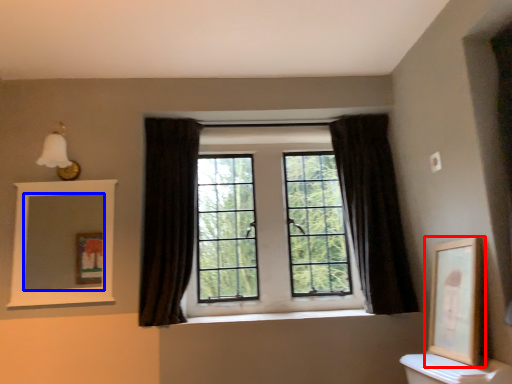
Question: Which object is closer to the camera taking this photo, picture frame (highlighted by a red box) or mirror (highlighted by a blue box)?

Choices:
 (A) picture frame
 (B) mirror

Answer: (A)